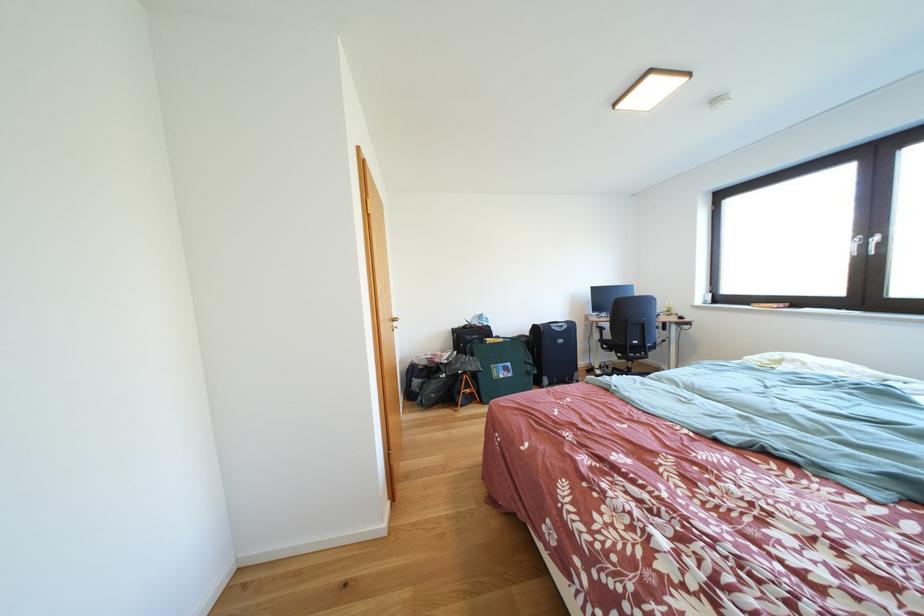
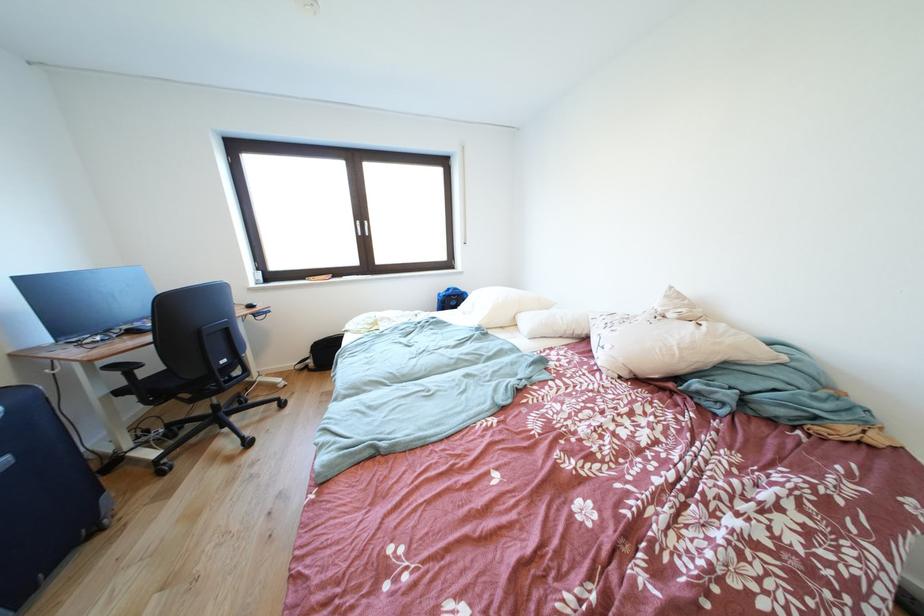
The point at (569,345) is marked in the first image. Where is the corresponding point in the second image?

(8, 468)